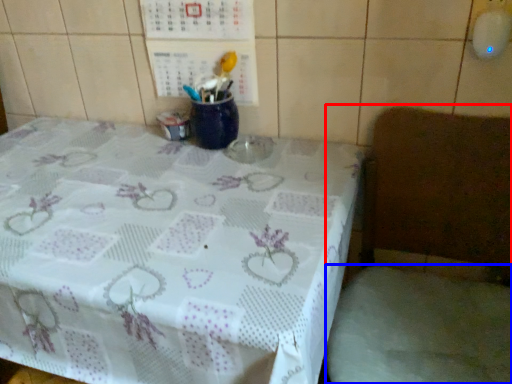
Question: Which point is closer to the camera, chair (highlighted by a red box) or fabric (highlighted by a blue box)?

Choices:
 (A) chair
 (B) fabric

Answer: (A)